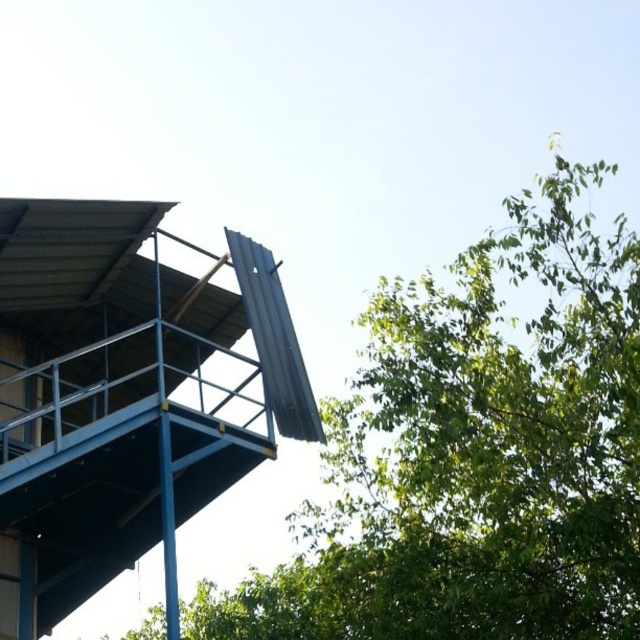
Between green leafy tree at upper right and blue metallic pole at upper left, which one has less height?

blue metallic pole at upper left

Image resolution: width=640 pixels, height=640 pixels. Describe the element at coordinates (476, 452) in the screenshot. I see `green leafy tree at upper right` at that location.

This screenshot has width=640, height=640. I want to click on green leafy tree at upper right, so click(x=476, y=452).

Does green leafy tree at upper right have a smaller size compared to metallic blue observation tower at upper left?

No, green leafy tree at upper right is not smaller than metallic blue observation tower at upper left.

Does point (593, 502) lie behind point (280, 364)?

That is False.

This screenshot has width=640, height=640. In order to click on green leafy tree at upper right in this screenshot , I will do `click(476, 452)`.

Which is above, metallic blue observation tower at upper left or blue metallic pole at upper left?

blue metallic pole at upper left

Is metallic blue observation tower at upper left above blue metallic pole at upper left?

No.

Describe the element at coordinates (122, 397) in the screenshot. I see `metallic blue observation tower at upper left` at that location.

The width and height of the screenshot is (640, 640). I want to click on metallic blue observation tower at upper left, so click(x=122, y=397).